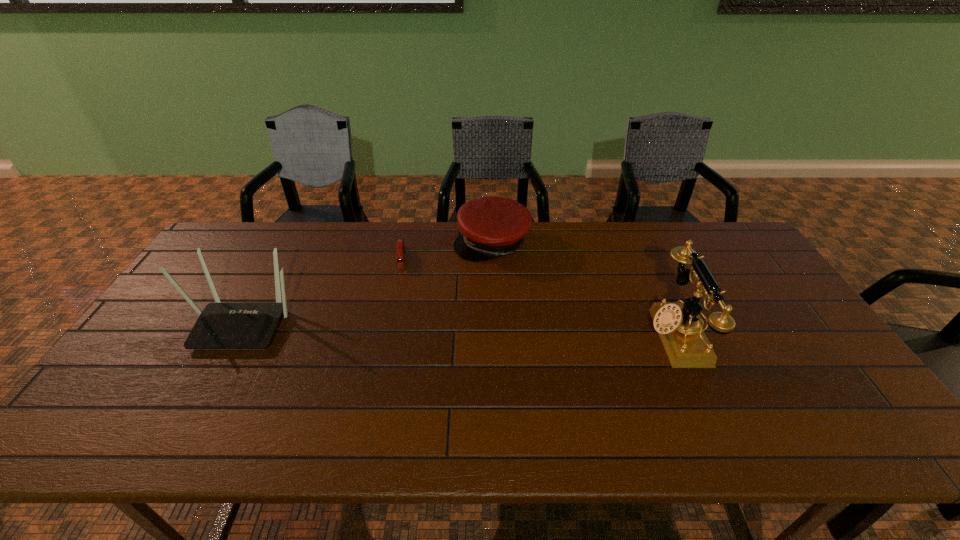
Identify the location of free space on the desktop that is between the third shortest object and the rightmost object and is positioned on the front-facing side of the second object from right to left. The image size is (960, 540). (450, 329).

The width and height of the screenshot is (960, 540). I want to click on free space on the desktop that is between the third shortest object and the telephone and is positioned on the front-facing side of the third object from right to left, so click(400, 327).